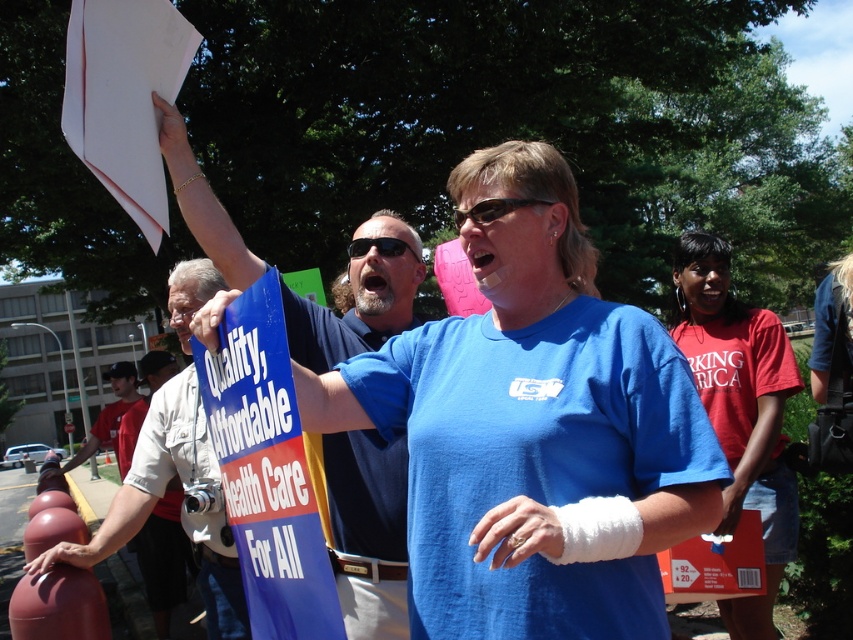
Question: Which of the following is the closest to the observer?

Choices:
 (A) light beige cotton shirt at center
 (B) white cotton shirt at center
 (C) blue fabric shirt at center

Answer: (C)

Question: Does white cotton shirt at center have a greater width compared to light beige cotton shirt at center?

Choices:
 (A) yes
 (B) no

Answer: (B)

Question: Which point is closer to the camera?

Choices:
 (A) (392, 314)
 (B) (175, 554)
 (C) (204, 452)

Answer: (A)

Question: Which point is closer to the camera?

Choices:
 (A) (364, 637)
 (B) (165, 493)

Answer: (A)

Question: Can you confirm if white cotton shirt at center is positioned to the right of light beige cotton shirt at center?

Choices:
 (A) no
 (B) yes

Answer: (B)

Question: Is blue fabric shirt at center thinner than light beige cotton shirt at center?

Choices:
 (A) no
 (B) yes

Answer: (B)